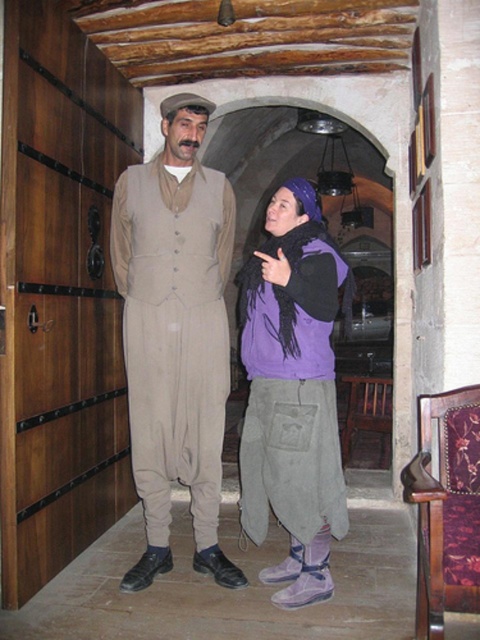
What do you see at coordinates (176, 333) in the screenshot?
I see `beige fabric suit at center` at bounding box center [176, 333].

Can you confirm if beige fabric suit at center is smaller than purple fleece vest at center?

Incorrect, beige fabric suit at center is not smaller in size than purple fleece vest at center.

Where is `beige fabric suit at center`? The image size is (480, 640). beige fabric suit at center is located at coordinates point(176,333).